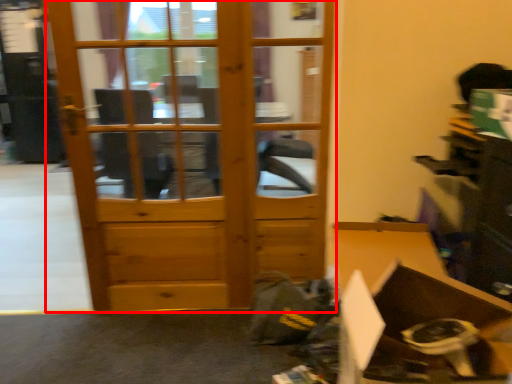
Question: Considering the relative positions of door (annotated by the red box) and cardboard box in the image provided, where is door (annotated by the red box) located with respect to the staircase?

Choices:
 (A) right
 (B) left

Answer: (B)